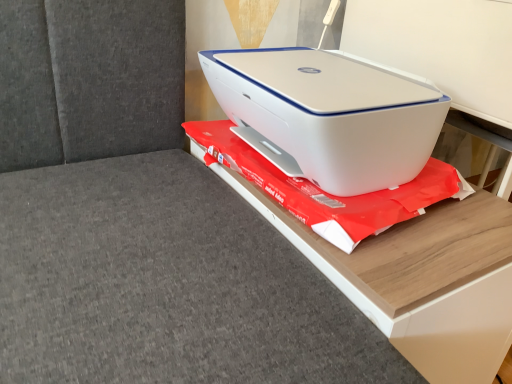
Question: Is the depth of white plastic printer at center greater than that of white plastic printer at upper center?

Choices:
 (A) yes
 (B) no

Answer: (A)

Question: Does white plastic printer at center appear on the left side of white plastic printer at upper center?

Choices:
 (A) no
 (B) yes

Answer: (B)

Question: Is white plastic printer at center thinner than white plastic printer at upper center?

Choices:
 (A) yes
 (B) no

Answer: (A)

Question: Is there a large distance between white plastic printer at center and white plastic printer at upper center?

Choices:
 (A) yes
 (B) no

Answer: (B)

Question: From a real-world perspective, is white plastic printer at center located beneath white plastic printer at upper center?

Choices:
 (A) yes
 (B) no

Answer: (B)

Question: Is white plastic printer at center in front of or behind white plastic printer at upper right in the image?

Choices:
 (A) front
 (B) behind

Answer: (B)

Question: From their relative heights in the image, would you say white plastic printer at center is taller or shorter than white plastic printer at upper right?

Choices:
 (A) short
 (B) tall

Answer: (A)

Question: Considering the positions of white plastic printer at center and white plastic printer at upper right in the image, is white plastic printer at center wider or thinner than white plastic printer at upper right?

Choices:
 (A) thin
 (B) wide

Answer: (B)

Question: From a real-world perspective, is white plastic printer at center physically located above or below white plastic printer at upper right?

Choices:
 (A) above
 (B) below

Answer: (B)

Question: Considering the positions of point (317, 206) and point (477, 292), is point (317, 206) closer or farther from the camera than point (477, 292)?

Choices:
 (A) farther
 (B) closer

Answer: (A)

Question: In terms of width, does white plastic printer at center look wider or thinner when compared to white plastic printer at upper center?

Choices:
 (A) wide
 (B) thin

Answer: (B)

Question: Is white plastic printer at center taller or shorter than white plastic printer at upper center?

Choices:
 (A) short
 (B) tall

Answer: (A)

Question: From a real-world perspective, is white plastic printer at center positioned above or below white plastic printer at upper center?

Choices:
 (A) below
 (B) above

Answer: (B)

Question: Considering the positions of white plastic printer at upper center and white plastic printer at center in the image, is white plastic printer at upper center taller or shorter than white plastic printer at center?

Choices:
 (A) tall
 (B) short

Answer: (A)

Question: Considering the relative positions of white plastic printer at upper center and white plastic printer at center in the image provided, is white plastic printer at upper center to the left or to the right of white plastic printer at center?

Choices:
 (A) right
 (B) left

Answer: (A)